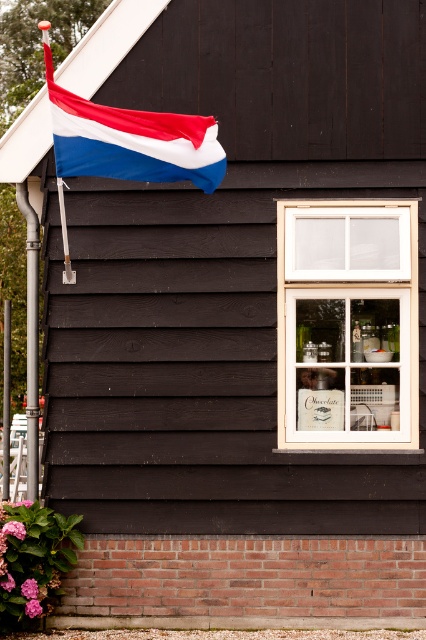
Question: Which point appears closest to the camera in this image?

Choices:
 (A) (169, 128)
 (B) (386, 266)

Answer: (A)

Question: Does white wooden window at center have a lesser width compared to matte fabric flag at upper left?

Choices:
 (A) no
 (B) yes

Answer: (B)

Question: Is white wooden window at center closer to camera compared to matte fabric flag at upper left?

Choices:
 (A) no
 (B) yes

Answer: (A)

Question: Among these objects, which one is farthest from the camera?

Choices:
 (A) white wooden window at center
 (B) matte fabric flag at upper left

Answer: (A)

Question: Does white wooden window at center come behind matte fabric flag at upper left?

Choices:
 (A) yes
 (B) no

Answer: (A)